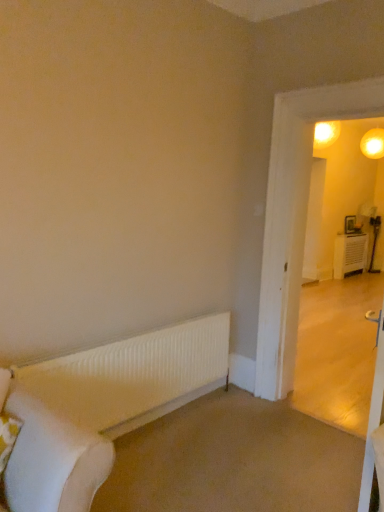
The height and width of the screenshot is (512, 384). I want to click on white ribbed radiator at lower left, so click(x=134, y=376).

What do you see at coordinates (134, 376) in the screenshot? This screenshot has height=512, width=384. I see `white ribbed radiator at lower left` at bounding box center [134, 376].

Find the location of a particular element. The width and height of the screenshot is (384, 512). white ribbed radiator at lower left is located at coordinates (134, 376).